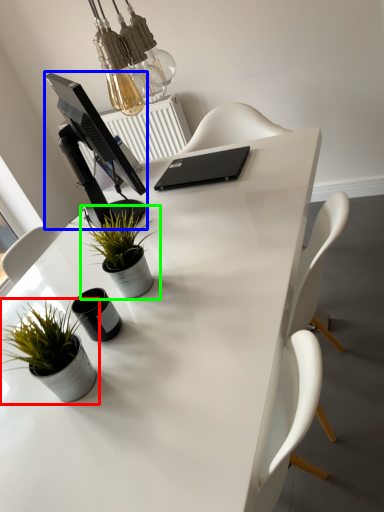
Question: Estimate the real-world distances between objects in this image. Which object is farther from houseplant (highlighted by a red box), computer monitor (highlighted by a blue box) or houseplant (highlighted by a green box)?

Choices:
 (A) computer monitor
 (B) houseplant

Answer: (A)